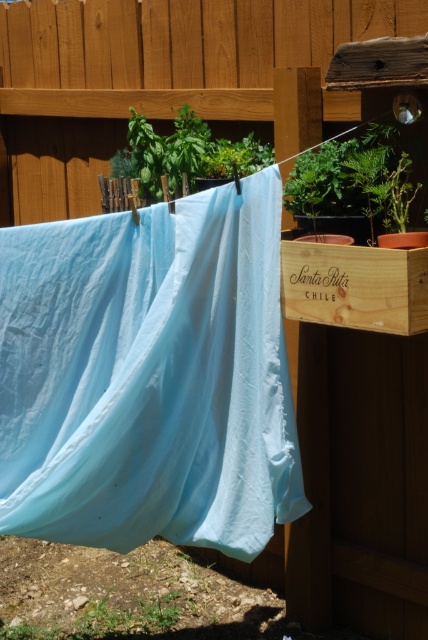
Question: Which object appears closest to the camera in this image?

Choices:
 (A) green leafy plant at upper right
 (B) light blue fabric at center
 (C) green leafy plant at upper center

Answer: (A)

Question: Does light blue fabric at center lie behind wooden at upper center?

Choices:
 (A) no
 (B) yes

Answer: (A)

Question: Can you confirm if light blue fabric at center is bigger than green leafy plant at upper right?

Choices:
 (A) no
 (B) yes

Answer: (B)

Question: Does light blue fabric at center have a smaller size compared to green leafy plant at upper right?

Choices:
 (A) yes
 (B) no

Answer: (B)

Question: Which point appears farthest from the camera in this image?

Choices:
 (A) (351, 154)
 (B) (86, 285)
 (C) (18, 180)
 (D) (190, 125)

Answer: (C)

Question: Which point appears farthest from the camera in this image?

Choices:
 (A) (261, 160)
 (B) (18, 195)

Answer: (B)